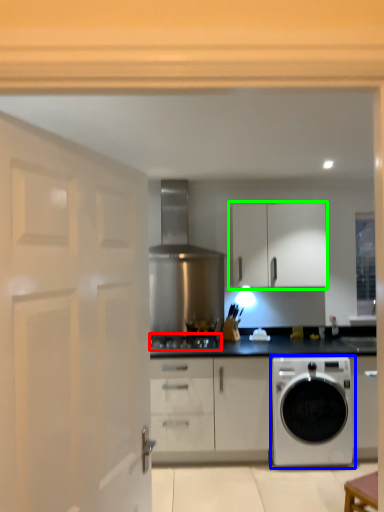
Question: Estimate the real-world distances between objects in this image. Which object is closer to gas stove (highlighted by a red box), washing machine (highlighted by a blue box) or cabinetry (highlighted by a green box)?

Choices:
 (A) washing machine
 (B) cabinetry

Answer: (A)